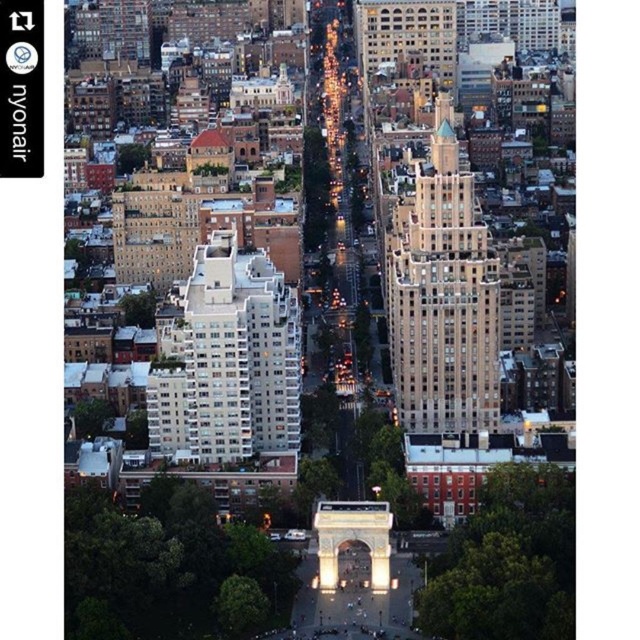
Is beige stone skyscraper at center smaller than white concrete building at center-left?

Incorrect, beige stone skyscraper at center is not smaller in size than white concrete building at center-left.

Is point (465, 406) closer to camera compared to point (168, 305)?

Yes, point (465, 406) is closer to viewer.

Identify the location of beige stone skyscraper at center. The image size is (640, 640). (442, 292).